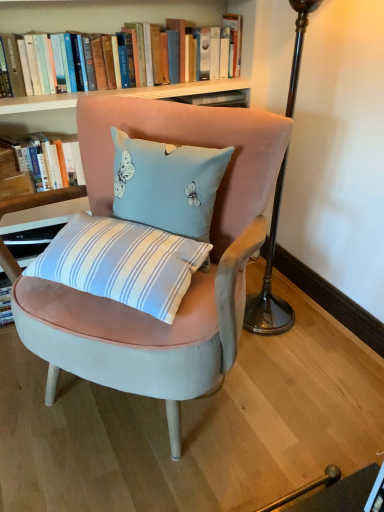
Question: From a real-world perspective, is hardcover books at upper center, the second book in the bottom-to-top sequence, above or below velvet pink chair at center?

Choices:
 (A) above
 (B) below

Answer: (A)

Question: Considering the positions of point click(34, 2) and point click(221, 258), is point click(34, 2) closer or farther from the camera than point click(221, 258)?

Choices:
 (A) farther
 (B) closer

Answer: (A)

Question: Estimate the real-world distances between objects in this image. Which object is farther from the light blue velvet cushion at center?

Choices:
 (A) hardcover book at upper left, which is counted as the 2th book, starting from the top
 (B) velvet pink chair at center
 (C) hardcover books at upper center, the second book in the bottom-to-top sequence

Answer: (C)

Question: Which object is positioned farthest from the hardcover books at upper center, the second book in the bottom-to-top sequence?

Choices:
 (A) velvet pink chair at center
 (B) hardcover book at upper left, positioned as the first book in bottom-to-top order
 (C) light blue velvet cushion at center

Answer: (A)